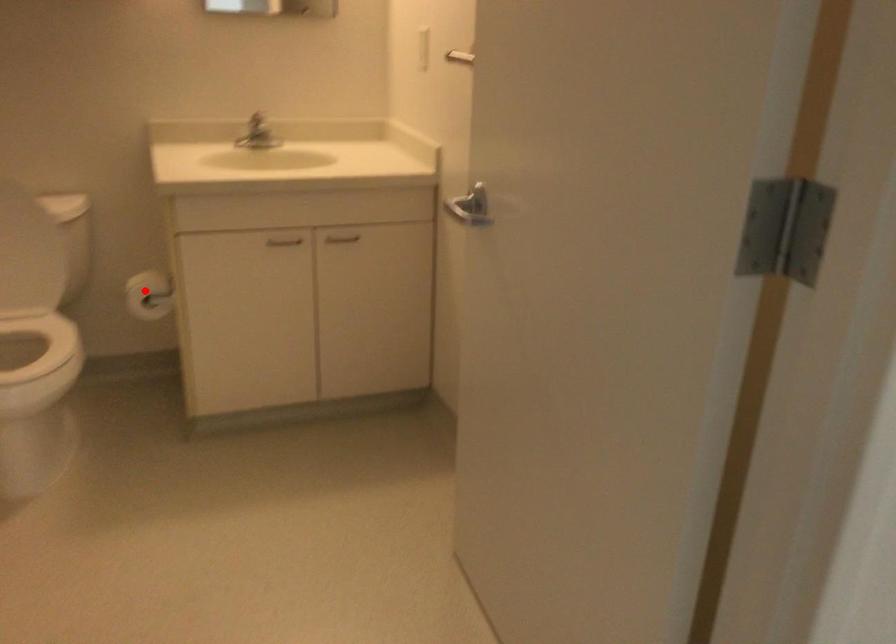
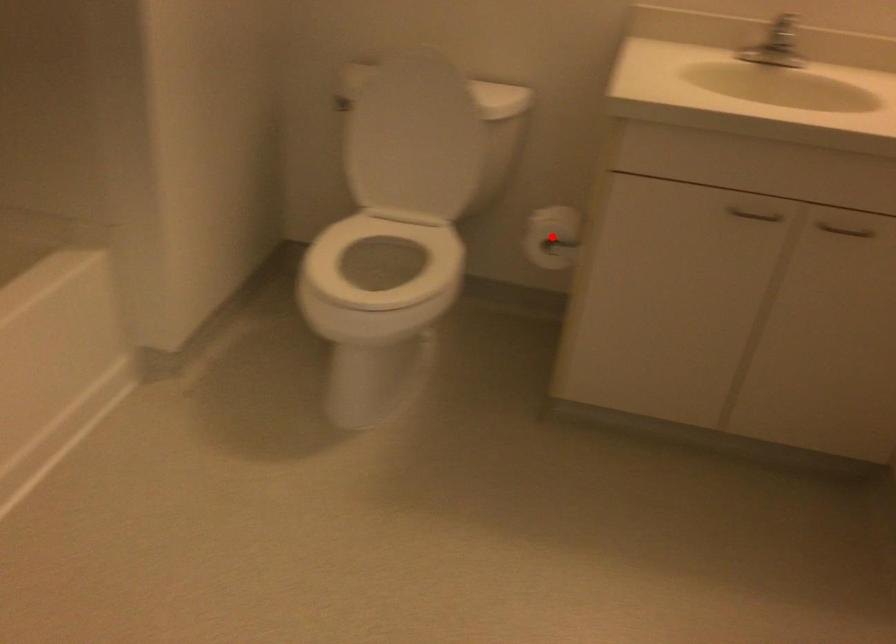
I am providing you with two images of the same scene from different viewpoints. A red point is marked on the first image and another point is marked on the second image. Is the marked point in image1 the same physical position as the marked point in image2?

Yes